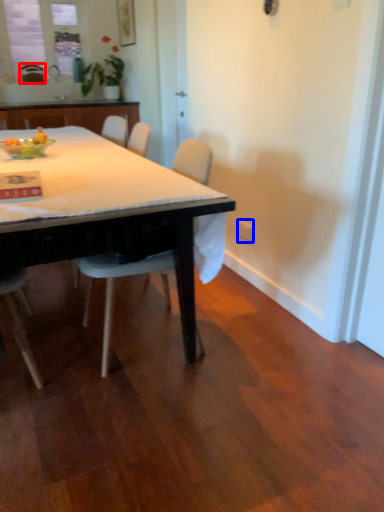
Question: Which object appears farthest to the camera in this image, chair (highlighted by a red box) or power outlet (highlighted by a blue box)?

Choices:
 (A) chair
 (B) power outlet

Answer: (A)